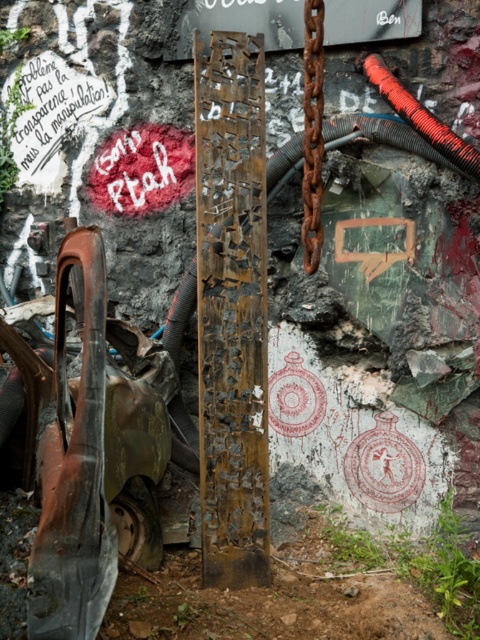
Between rusty metal sign at upper center and rusty metal chain at center, which one has more height?

rusty metal chain at center

Does rusty metal sign at upper center have a smaller size compared to rusty metal chain at center?

Incorrect, rusty metal sign at upper center is not smaller in size than rusty metal chain at center.

Is point (360, 1) in front of point (307, 134)?

No.

Locate an element on the screen. This screenshot has width=480, height=640. rusty metal sign at upper center is located at coordinates coord(240,22).